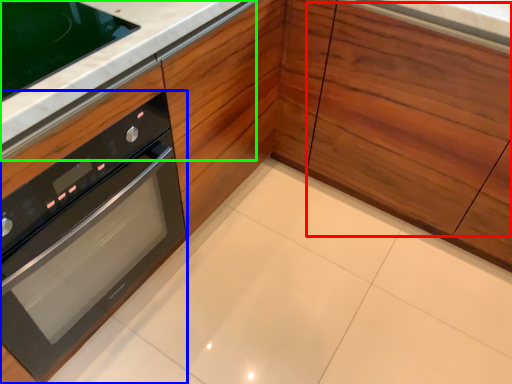
Question: Which object is positioned closest to drawer (highlighted by a red box)? Select from oven (highlighted by a blue box) and counter top (highlighted by a green box).

Choices:
 (A) oven
 (B) counter top

Answer: (B)